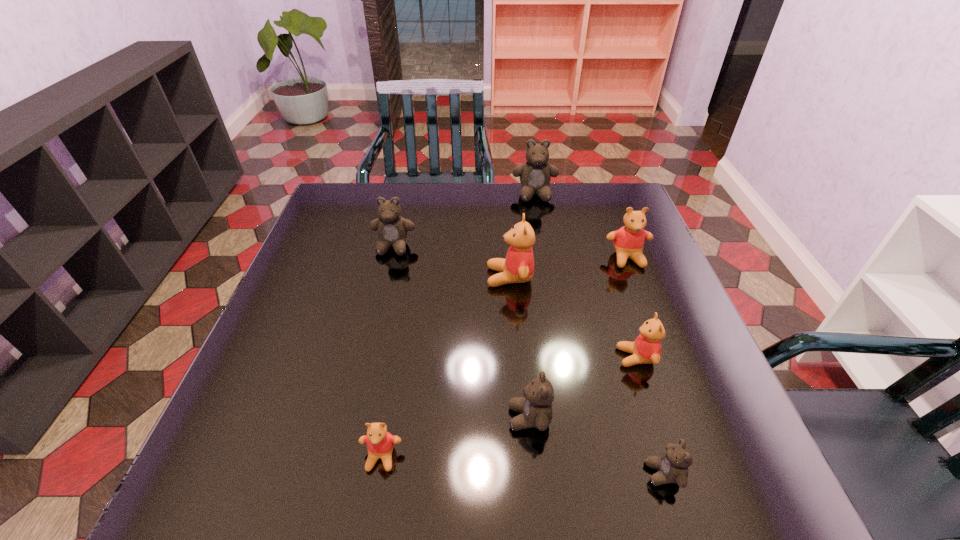
Locate an element on the screen. the farthest teddy bear is located at coordinates (535, 174).

You are a GUI agent. You are given a task and a screenshot of the screen. Output one action in this format:
    pyautogui.click(x=<x>, y=<y>)
    Task: Click on the farthest brown teddy bear
    This screenshot has height=540, width=960.
    Given the screenshot: What is the action you would take?
    pyautogui.click(x=535, y=174)

I want to click on the biggest red teddy bear, so click(518, 267).

Locate an element on the screen. the third smallest brown teddy bear is located at coordinates (392, 229).

At what (x,y) coordinates should I click in order to perform the action: click on the third nearest brown teddy bear. Please return your answer as a coordinate pair (x, y). This screenshot has width=960, height=540. Looking at the image, I should click on point(392,229).

I want to click on the second biggest red teddy bear, so click(x=628, y=241).

The image size is (960, 540). What are the coordinates of `the third farthest red teddy bear` in the screenshot? It's located at (646, 349).

The height and width of the screenshot is (540, 960). Find the location of `the fourth nearest object`. the fourth nearest object is located at coordinates (646, 349).

Image resolution: width=960 pixels, height=540 pixels. I want to click on the second nearest brown teddy bear, so click(536, 410).

You are a GUI agent. You are given a task and a screenshot of the screen. Output one action in this format:
    pyautogui.click(x=<x>, y=<y>)
    Task: Click on the nearest brown teddy bear
    This screenshot has width=960, height=540.
    Given the screenshot: What is the action you would take?
    pyautogui.click(x=672, y=467)